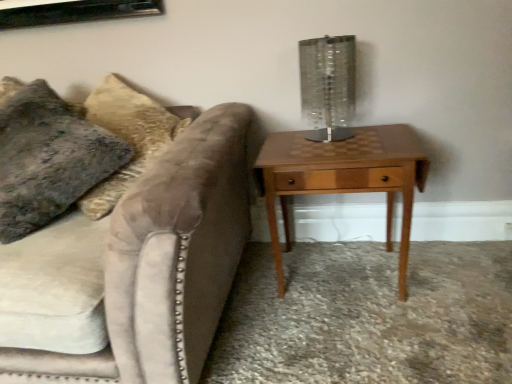
In order to click on free space below woodenmaterial/texturenightstand at right (from a real-world perspective) in this screenshot , I will do `click(340, 279)`.